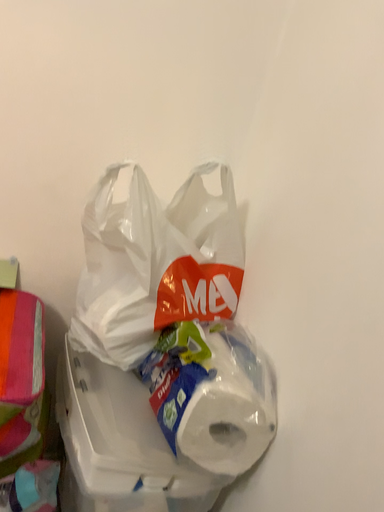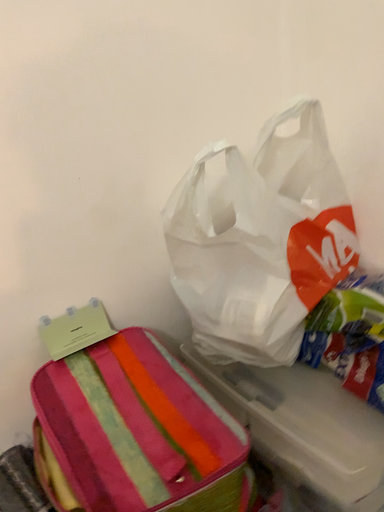
Question: Which way did the camera rotate in the video?

Choices:
 (A) rotated right
 (B) rotated left

Answer: (A)